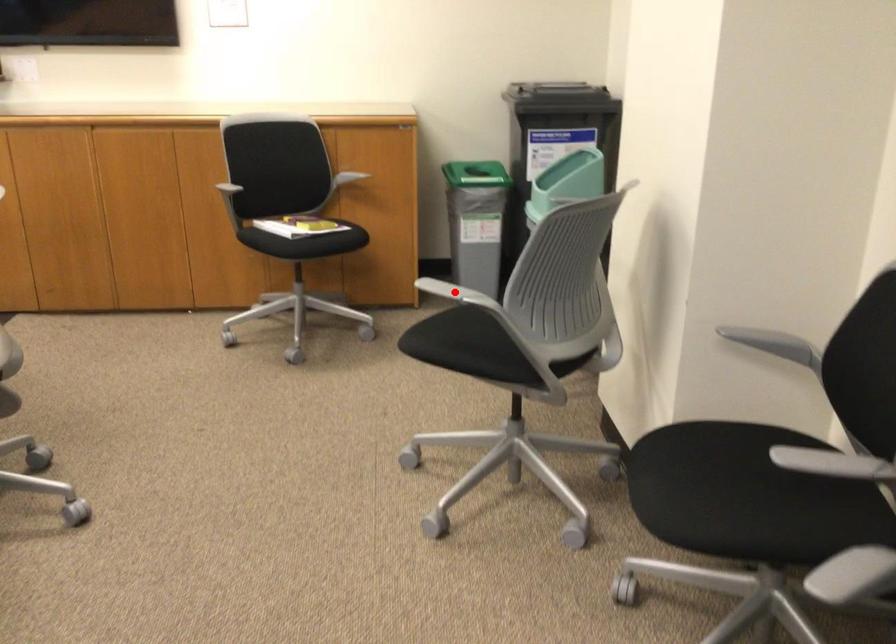
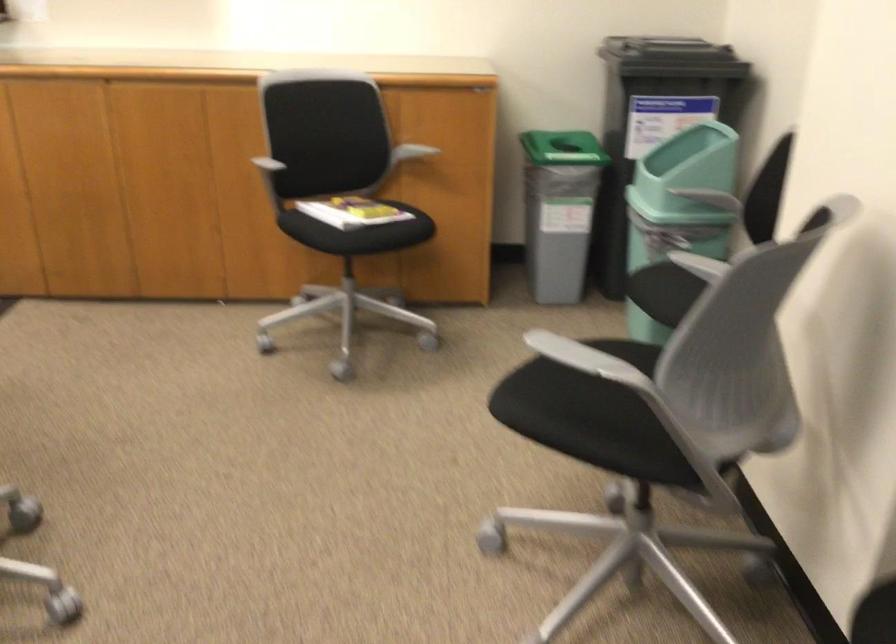
Question: A red point is marked in image1. In image2, is the corresponding 3D point closer to the camera or farther? Reply with the corresponding letter.

Choices:
 (A) The corresponding 3D point is closer.
 (B) The corresponding 3D point is farther.

Answer: (A)